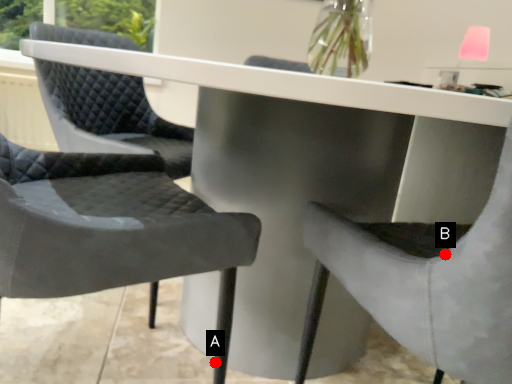
Question: Two points are circled on the image, labeled by A and B beside each circle. Which point is closer to the camera?

Choices:
 (A) A is closer
 (B) B is closer

Answer: (B)